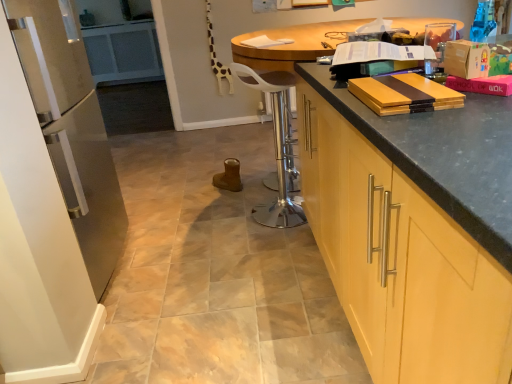
The image size is (512, 384). Identify the location of vacant area located to the right-hand side of white paper at center, which ranks as the 1th book in back-to-front order. 302,40.